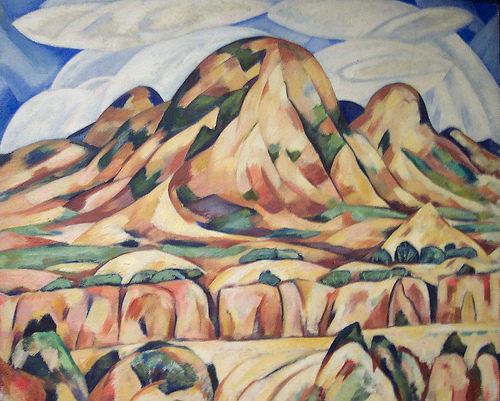
The image size is (500, 401). Find the location of `art`. art is located at coordinates (298, 148).